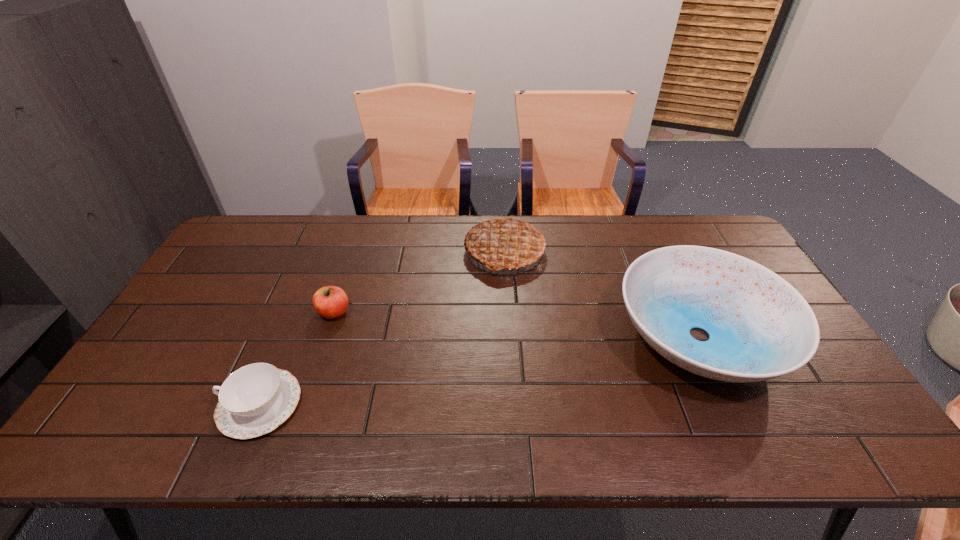
The image size is (960, 540). In order to click on object that is the third nearest to the second tallest object in this screenshot , I will do `click(254, 400)`.

The image size is (960, 540). Find the location of `free space that satisfies the following two spatial constraints: 1. on the front side of the second tallest object; 2. on the handle side of the chinaware`. free space that satisfies the following two spatial constraints: 1. on the front side of the second tallest object; 2. on the handle side of the chinaware is located at coordinates (732, 404).

Locate an element on the screen. This screenshot has width=960, height=540. vacant space that satisfies the following two spatial constraints: 1. on the back side of the third object from left to right; 2. on the right side of the apple is located at coordinates (354, 252).

Locate an element on the screen. Image resolution: width=960 pixels, height=540 pixels. free space that satisfies the following two spatial constraints: 1. on the front side of the tallest object; 2. on the handle side of the chinaware is located at coordinates (515, 404).